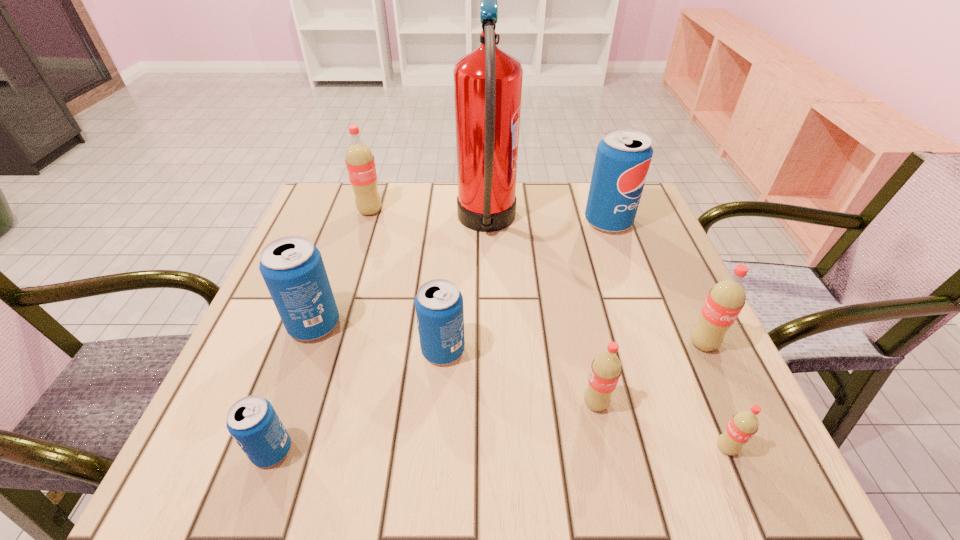
I want to click on vacant space that satisfies the following two spatial constraints: 1. on the front side of the fire extinguisher; 2. on the left side of the farthest red soda, so click(366, 225).

Where is `vacant point that satisfies the following two spatial constraints: 1. on the back side of the smallest red soda; 2. on the left side of the smallest blue soda can`? vacant point that satisfies the following two spatial constraints: 1. on the back side of the smallest red soda; 2. on the left side of the smallest blue soda can is located at coordinates (273, 448).